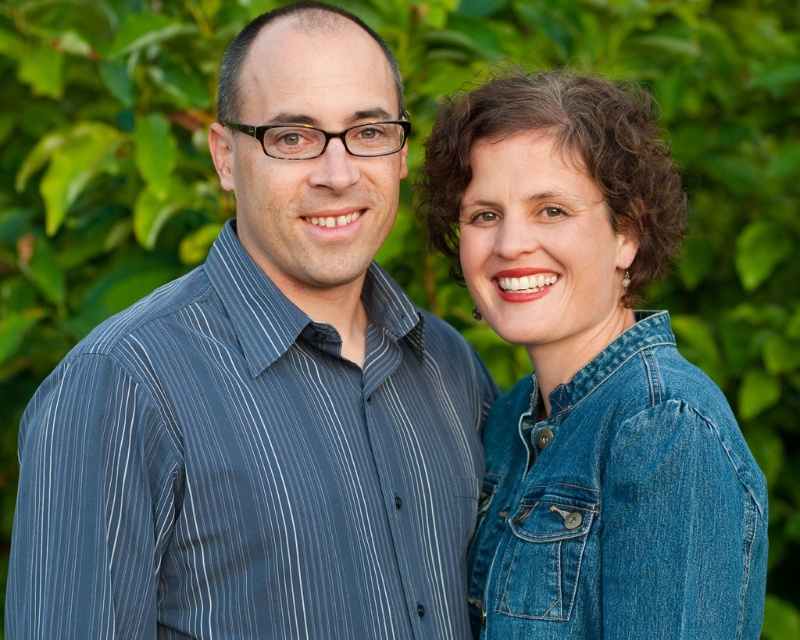
You are a photographer trying to focus on the blue striped shirt at left in the image. The camera you are using has a focus point at position (264,394). Is this focus point correctly positioned to capture the blue striped shirt at left?

Yes, the focus point at (264,394) is correctly positioned because the Objects Description states that this point marks the blue striped shirt at left.

You are standing in a garden and see two points marked in the image. The first point is at coordinates point (x=90, y=532) and the second is at point (x=582, y=449). Which point is nearer to you?

Point (x=90, y=532) is closer to the viewer than point (x=582, y=449).

You are a photographer trying to capture a photo of both the blue striped shirt at left and the denim jacket at lower right. Since you want both subjects to be in the frame, which direction should you move the camera to ensure both are fully visible?

The blue striped shirt at left is to the left of the denim jacket at lower right, so you should move the camera slightly to the right to ensure both are fully visible.